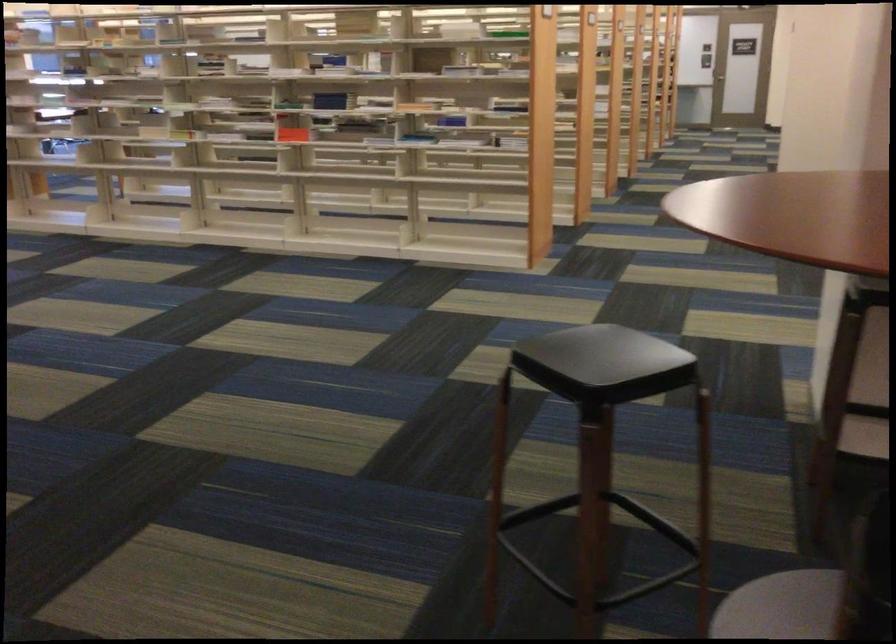
This screenshot has height=644, width=896. Find the location of `red book`. red book is located at coordinates [291, 131].